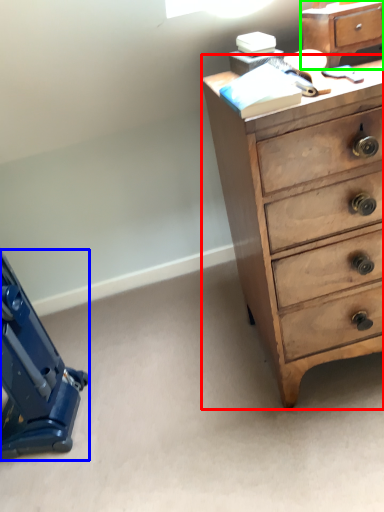
Question: Which object is the closest to the chest of drawers (highlighted by a red box)? Choose among these: equipment (highlighted by a blue box) or file cabinet (highlighted by a green box).

Choices:
 (A) equipment
 (B) file cabinet

Answer: (B)